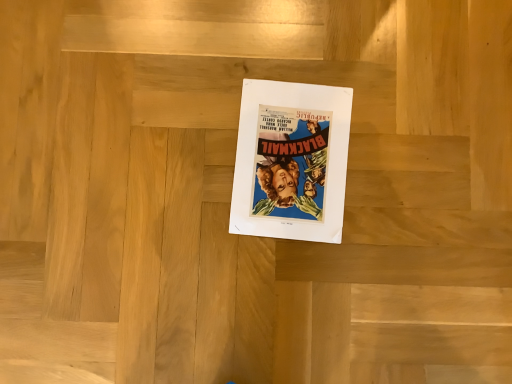
The image size is (512, 384). I want to click on free space to the left of matte paper poster at center, so click(177, 138).